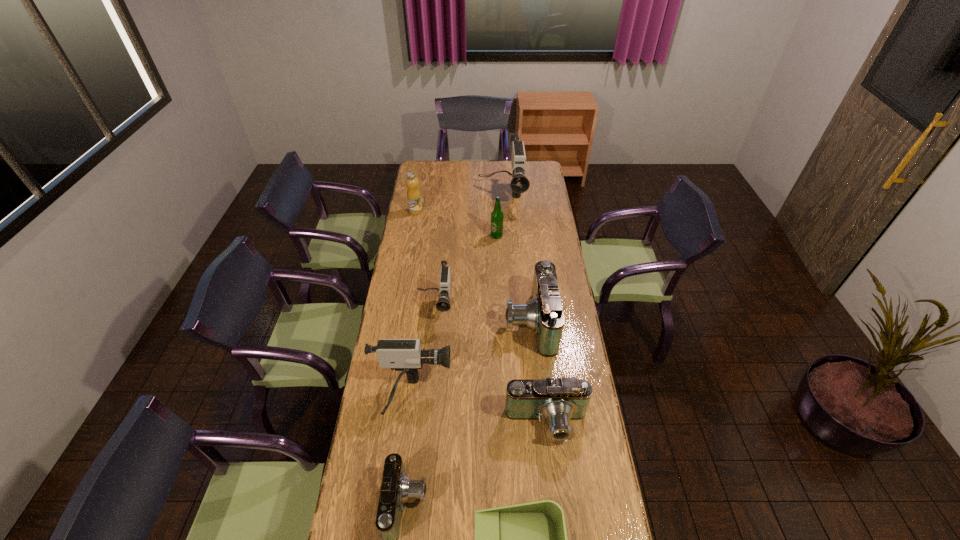
Identify the location of the rightmost white camcorder. The width and height of the screenshot is (960, 540). (519, 184).

I want to click on the tallest object, so point(519,184).

Where is `fruit juice`? The width and height of the screenshot is (960, 540). fruit juice is located at coordinates (413, 193).

This screenshot has height=540, width=960. I want to click on beer bottle, so (x=497, y=216).

The image size is (960, 540). I want to click on green beer bottle, so click(x=497, y=216).

Locate an element on the screen. The image size is (960, 540). the nearest white camcorder is located at coordinates (405, 355).

In order to click on the farthest blue camcorder in this screenshot , I will do `click(543, 314)`.

Where is `the second nearest blue camcorder`? the second nearest blue camcorder is located at coordinates (558, 401).

Find the location of `the second nearest white camcorder`. the second nearest white camcorder is located at coordinates (443, 304).

Locate an element on the screen. free space located 0.360m on the recording direction of the rightmost white camcorder is located at coordinates (505, 258).